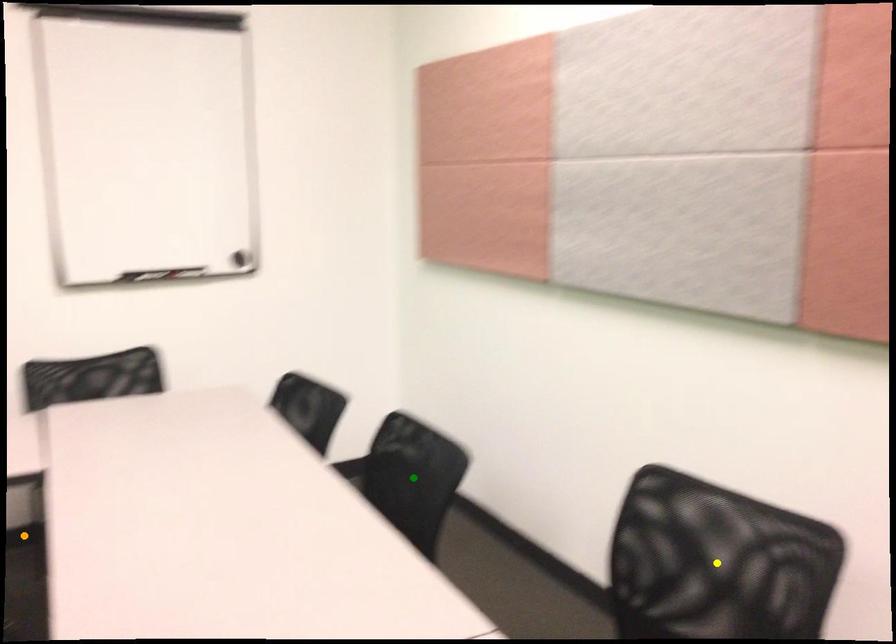
Order these from nearest to farthest:
A) orange point
B) green point
C) yellow point

orange point < green point < yellow point